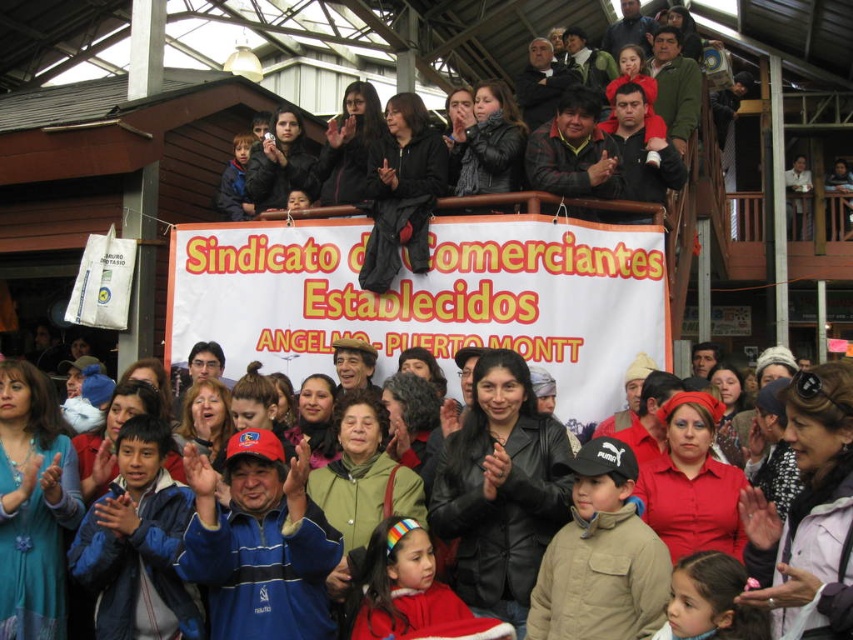
Question: Can you confirm if tan fleece jacket at center is smaller than red fleece jacket at lower center?

Choices:
 (A) no
 (B) yes

Answer: (A)

Question: Does blue fleece jacket at center appear under red fleece jacket at lower center?

Choices:
 (A) no
 (B) yes

Answer: (A)

Question: Which object is the closest to the red fleece jacket at lower center?

Choices:
 (A) tan fleece jacket at center
 (B) blue fleece jacket at center

Answer: (A)

Question: Can you confirm if matte black jacket at center is positioned below blue fleece jacket at center?

Choices:
 (A) no
 (B) yes

Answer: (A)

Question: Which object appears farthest from the camera in this image?

Choices:
 (A) red fleece jacket at lower center
 (B) tan fleece jacket at center
 (C) blue fleece jacket at center
 (D) matte black jacket at center

Answer: (C)

Question: Which point is closer to the camera?

Choices:
 (A) matte black jacket at center
 (B) tan fleece jacket at center
 (C) red fleece jacket at lower center
 (D) blue fleece jacket at center

Answer: (A)